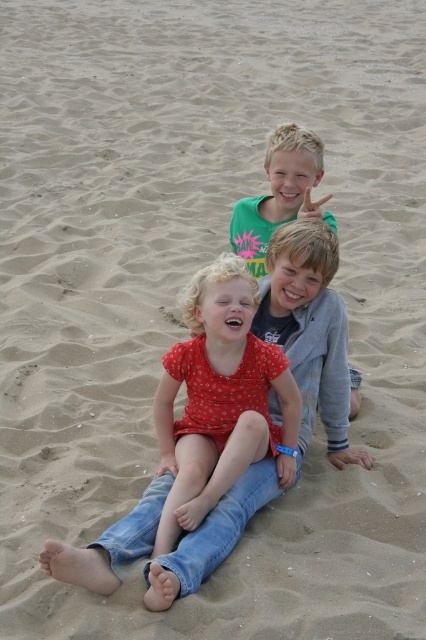
You are a photographer trying to capture a group photo of the children on the beach. You want to ensure that both the red dotted shirt at center and the green cotton shirt at upper center are clearly visible in the frame. Given that your camera has a minimum focus distance of 90 centimeters, will you need to adjust your position to include both children in the shot?

The red dotted shirt at center and green cotton shirt at upper center are 94.27 centimeters apart from each other. Since the distance between them is greater than the camera minimum focus distance of 90 centimeters, you will need to adjust your position to ensure both are in focus and clearly visible in the frame.

You are a photographer trying to capture a group photo of the children on the beach. You want to ensure that the child in the red dotted shirt at center is positioned exactly in the center of the frame. Based on their current location at point 0.625, 0.516, will you need to adjust the camera angle to the left or right to center them?

The red dotted shirt at center is located at point (219, 400), which is slightly to the right of the frame center. To position them exactly in the center, you should adjust the camera angle to the left.

You are standing on the beach and want to place a small flag at point A and point B. Point A is at coordinates point (250, 452) and point B is at coordinates point (311, 152). Which point is closer to you?

Point A at coordinates point (250, 452) is closer to you than point B at coordinates point (311, 152).